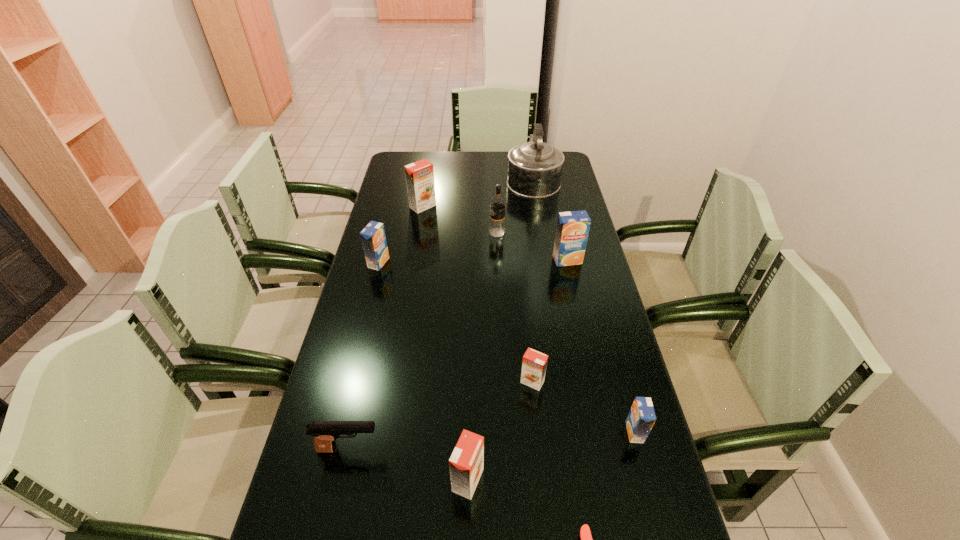
You are a GUI agent. You are given a task and a screenshot of the screen. Output one action in this format:
    pyautogui.click(x=<x>, y=<y>)
    Task: Click on the vacant space located 0.400m on the label of the eighth nearest object
    The width and height of the screenshot is (960, 540).
    Given the screenshot: What is the action you would take?
    coord(379,233)

You are a GUI agent. You are given a task and a screenshot of the screen. Output one action in this format:
    pyautogui.click(x=<x>, y=<y>)
    Task: Click on the blank space located 0.130m on the label of the eighth nearest object
    This screenshot has width=960, height=540.
    Given the screenshot: What is the action you would take?
    pyautogui.click(x=453, y=233)

Where is `vacant space located on the back of the fifth orange_juice from right to left`? This screenshot has width=960, height=540. vacant space located on the back of the fifth orange_juice from right to left is located at coordinates (431, 159).

I want to click on free space located on the back of the second blue orange_juice from left to right, so click(x=558, y=217).

At what (x,y) coordinates should I click in order to perform the action: click on vacant space located 0.190m on the back of the second biggest blue orange_juice. Please return your answer as a coordinate pair (x, y). Looking at the image, I should click on click(x=389, y=222).

Where is `vacant position located on the right of the nearest orange_juice`? The height and width of the screenshot is (540, 960). vacant position located on the right of the nearest orange_juice is located at coordinates (553, 480).

Where is `vacant area situated 0.170m at the barrel of the black pistol`? vacant area situated 0.170m at the barrel of the black pistol is located at coordinates (455, 449).

Identify the location of free space located on the back of the second farthest orange orange juice. Image resolution: width=960 pixels, height=540 pixels. [x=522, y=280].

Find the location of a particular element. free space located on the left of the smallest blue orange_juice is located at coordinates (467, 432).

Locate an element on the screen. object present at the far edge is located at coordinates (535, 168).